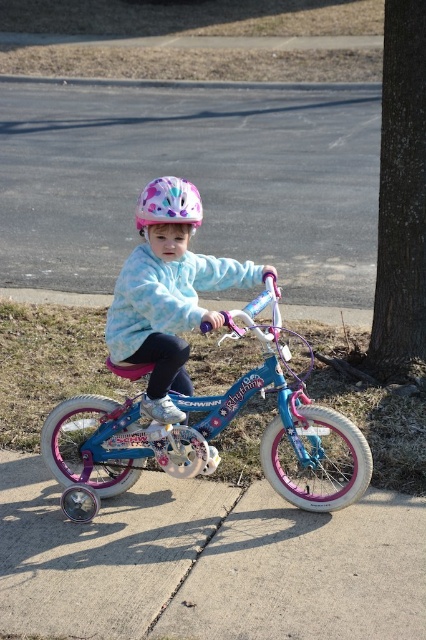
Question: Can you confirm if shiny blue bicycle at center is positioned below pastel fleece jacket at center?

Choices:
 (A) yes
 (B) no

Answer: (A)

Question: Which of the following is the farthest from the observer?

Choices:
 (A) (333, 116)
 (B) (253, 608)

Answer: (A)

Question: Which point is farther to the camera?

Choices:
 (A) smooth concrete pavement at center
 (B) pastel polka dot helmet at center
 (C) pastel fleece jacket at center

Answer: (B)

Question: Which point is closer to the camera?

Choices:
 (A) (54, 589)
 (B) (189, 212)

Answer: (A)

Question: Does shiny blue bicycle at center have a lesser width compared to brown rough bark tree at right?

Choices:
 (A) yes
 (B) no

Answer: (B)

Question: Is shiny blue bicycle at center wider than brown rough bark tree at right?

Choices:
 (A) no
 (B) yes

Answer: (B)